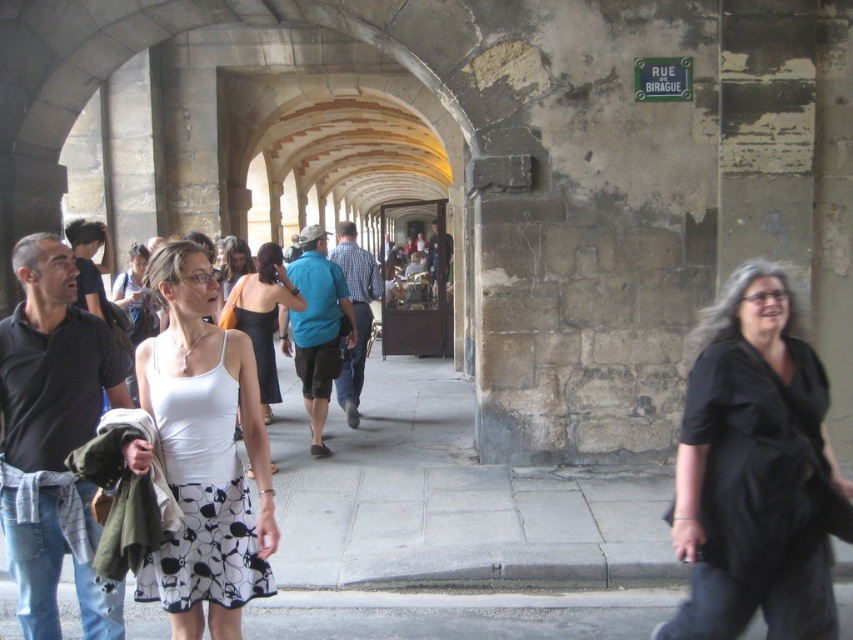
Between point (799, 448) and point (257, 483), which one is positioned behind?

The point (257, 483) is more distant.

Can you confirm if black matte shirt at right is positioned to the left of white printed fabric dress at center?

Incorrect, black matte shirt at right is not on the left side of white printed fabric dress at center.

Locate an element on the screen. Image resolution: width=853 pixels, height=640 pixels. black matte shirt at right is located at coordinates (755, 472).

Which of these two, gray concrete pavement at lower center or white matte dress at center, stands taller?

With more height is white matte dress at center.

The width and height of the screenshot is (853, 640). Identify the location of gray concrete pavement at lower center. (457, 614).

Find the location of `gray concrete pavement at lower center`. gray concrete pavement at lower center is located at coordinates (457, 614).

Does white printed fabric dress at center appear on the right side of white matte dress at center?

Correct, you'll find white printed fabric dress at center to the right of white matte dress at center.

Between point (219, 579) and point (260, 323), which one is positioned in front?

Point (219, 579) is in front.

Which is in front, point (184, 387) or point (296, 291)?

Positioned in front is point (184, 387).

Find the location of a particular element. The image size is (853, 640). white printed fabric dress at center is located at coordinates (207, 483).